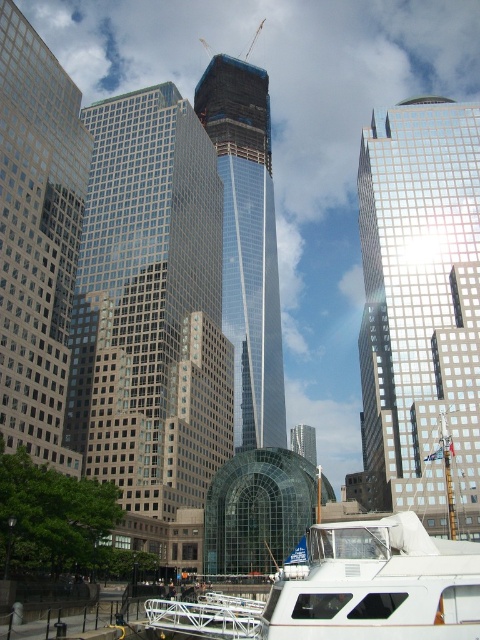
In the urban scene with modern skyscrapers, you notice two central skyscrapers labeled as the glassy skyscraper at center and the reflective glass skyscraper at center. Which of these two skyscrapers is taller?

The glassy skyscraper at center is much taller than the reflective glass skyscraper at center.